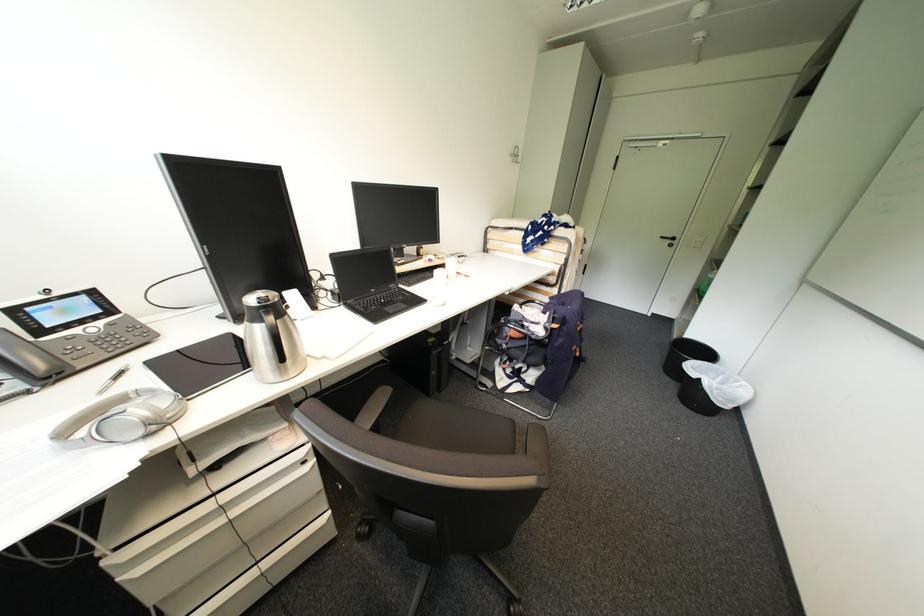
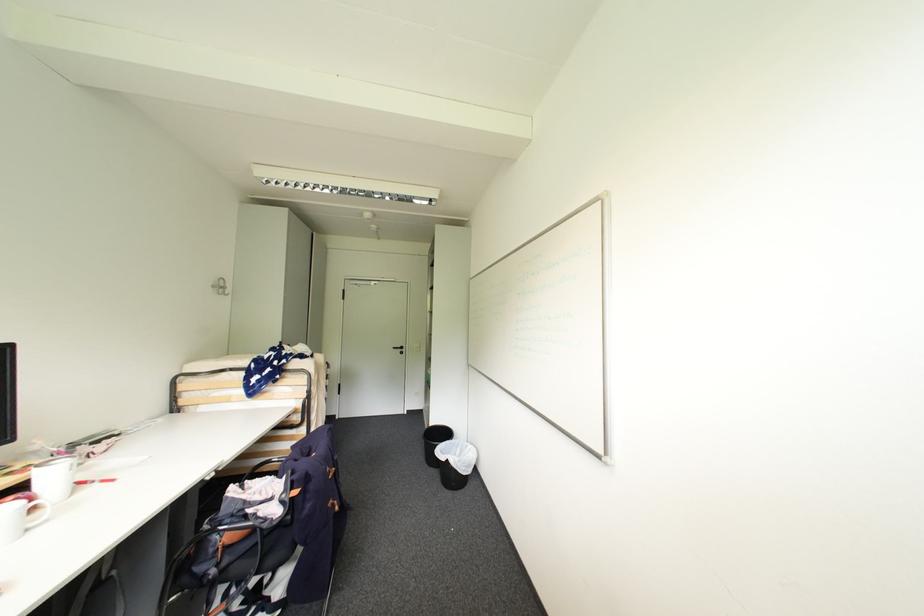
Locate, in the second image, the point that corresponds to (457,264) in the first image.

(58, 475)